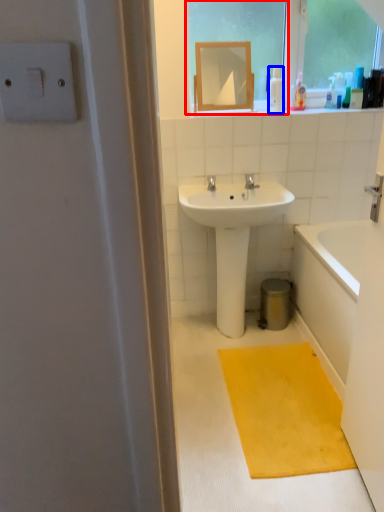
Question: Among these objects, which one is farthest to the camera, window screen (highlighted by a red box) or toiletry (highlighted by a blue box)?

Choices:
 (A) window screen
 (B) toiletry

Answer: (B)